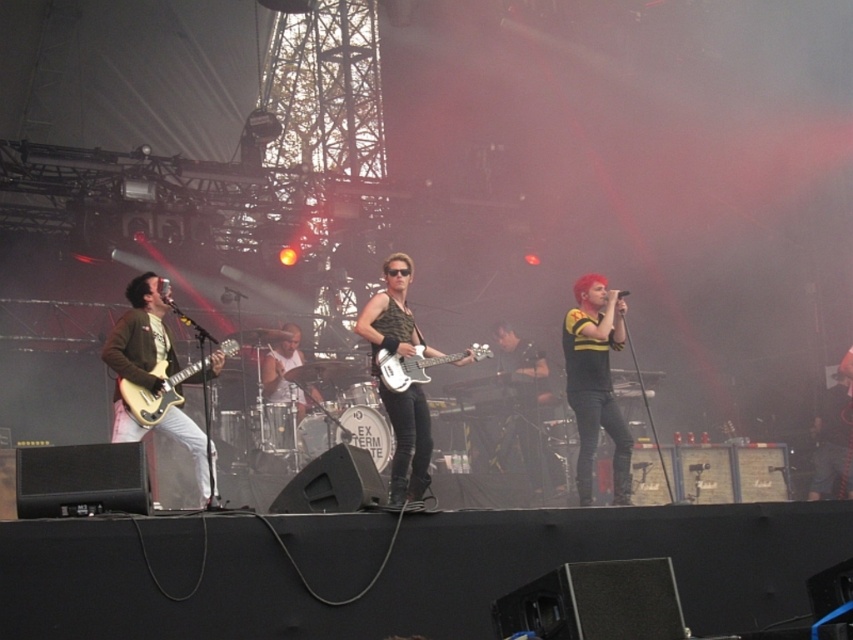
Question: Does shiny black microphone at center come in front of matte brown electric guitar at left?

Choices:
 (A) yes
 (B) no

Answer: (B)

Question: Observing the image, what is the correct spatial positioning of camouflage fabric tank top at center in reference to matte brown electric guitar at left?

Choices:
 (A) below
 (B) above

Answer: (A)

Question: Which of the following is the closest to the observer?

Choices:
 (A) white glossy bass guitar at center
 (B) camouflage fabric tank top at center

Answer: (B)

Question: Among these objects, which one is farthest from the camera?

Choices:
 (A) matte brown electric guitar at left
 (B) white glossy bass guitar at center

Answer: (B)

Question: Which point is closer to the camera?

Choices:
 (A) camouflage fabric tank top at center
 (B) white glossy bass guitar at center
 (C) shiny black microphone at center

Answer: (A)

Question: Can you confirm if matte brown electric guitar at left is bigger than white glossy bass guitar at center?

Choices:
 (A) yes
 (B) no

Answer: (A)